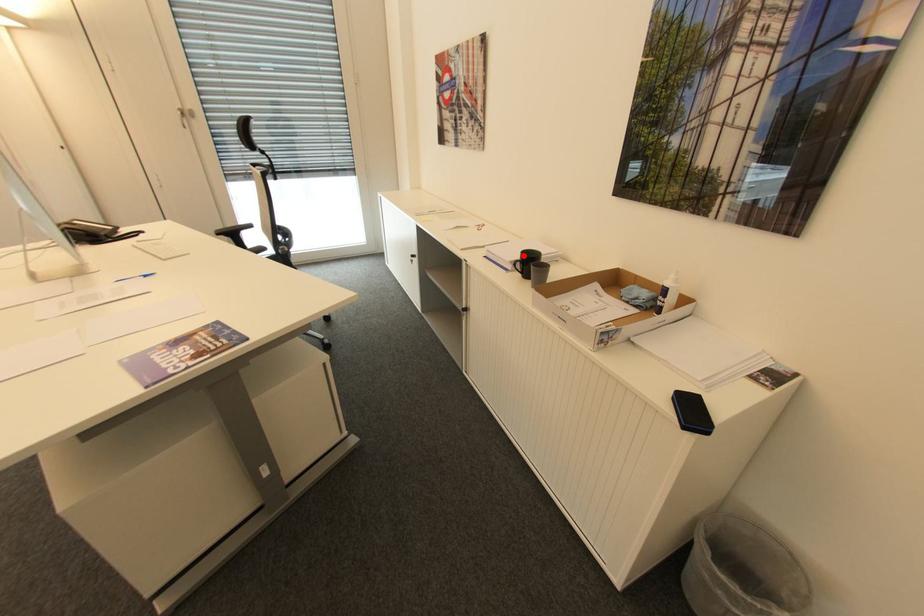
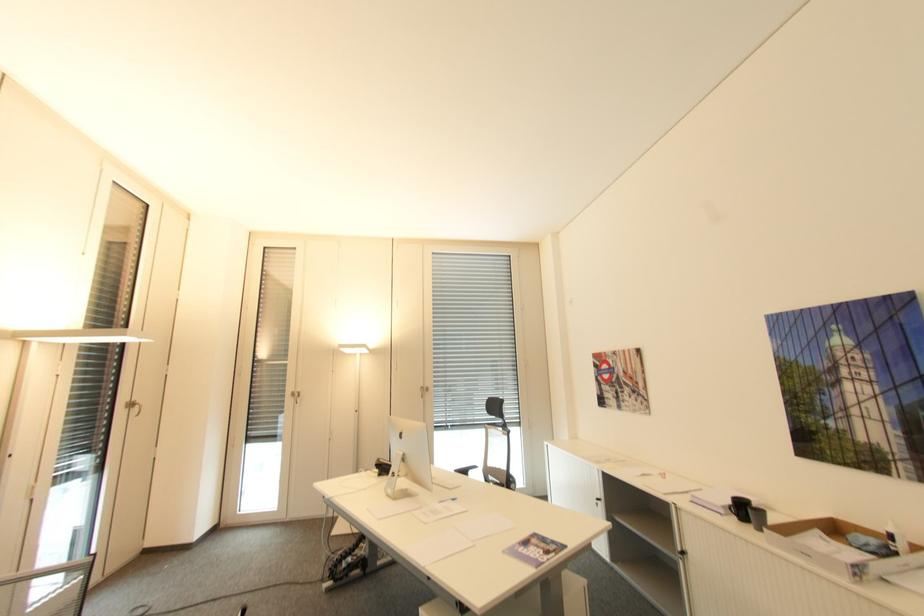
The point at the highlighted location is marked in the first image. Where is the corresponding point in the second image?

(734, 501)